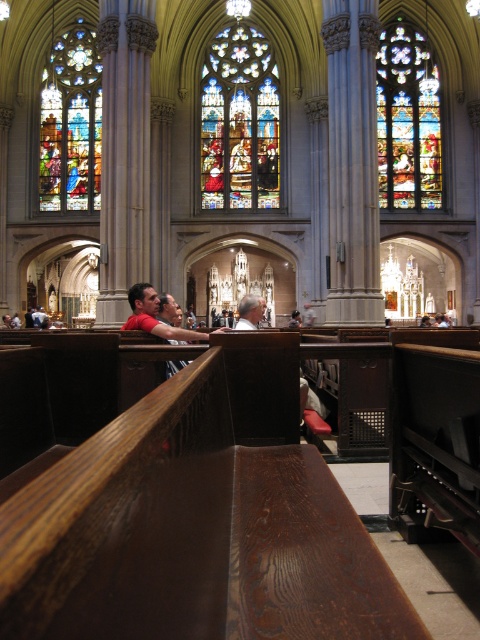
From the picture: You are standing inside the cathedral and want to take a photo of both the multicolored stained glass at center and the stained glass window at upper left. Which one would appear larger in your camera viewfinder?

The multicolored stained glass at center would appear larger in the camera viewfinder because it is closer to the viewer than the stained glass window at upper left.

You are an architect visiting the cathedral and want to compare the stained glass windows. Which stained glass window has a smaller width between the stained glass window at upper right and the stained glass window at upper left?

The stained glass window at upper right has a smaller width compared to the stained glass window at upper left.

What is the spatial relationship between the multicolored stained glass at center and the stained glass window at upper right in the cathedral?

The multicolored stained glass at center is positioned to the left of the stained glass window at upper right.